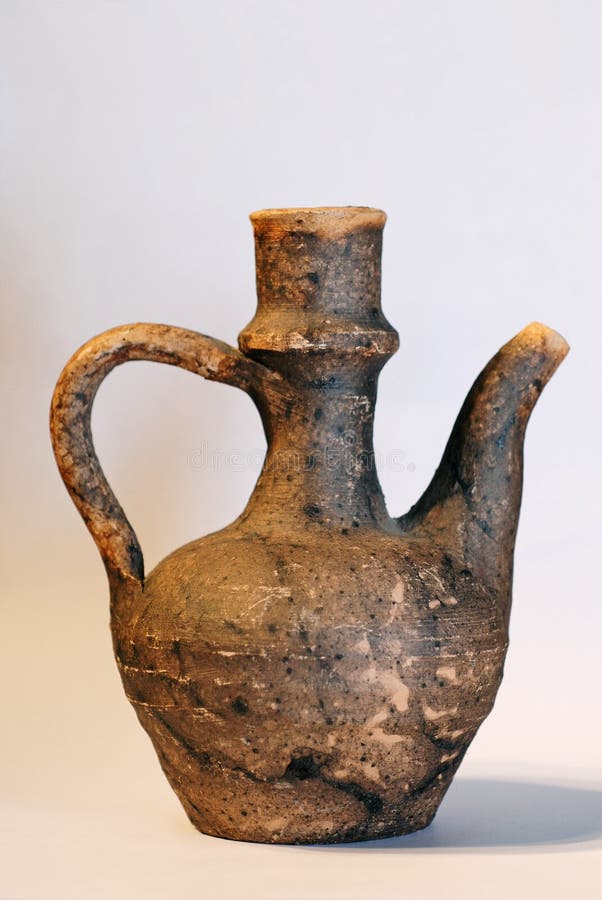
Where is `handle`? This screenshot has width=602, height=900. handle is located at coordinates (92, 355).